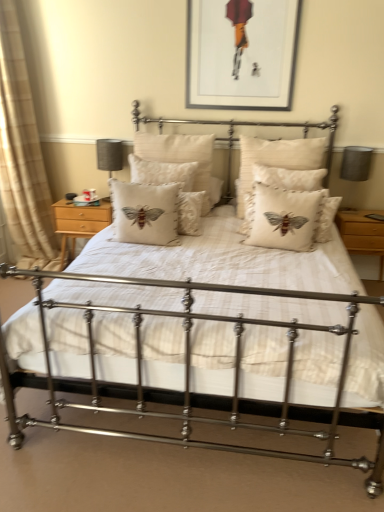
In order to click on vacant space underneath matte gray lampshade at right, the second table lamp positioned from the left (from a real-world perspective) in this screenshot , I will do `click(347, 212)`.